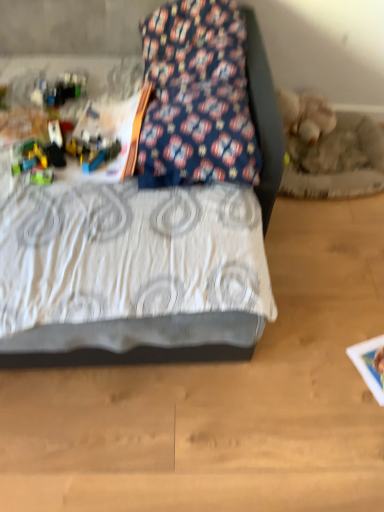
Question: Is floral fabric pillow at upper center smaller than translucent plastic blocks at left?

Choices:
 (A) yes
 (B) no

Answer: (B)

Question: Is floral fabric pillow at upper center to the right of translucent plastic blocks at left from the viewer's perspective?

Choices:
 (A) yes
 (B) no

Answer: (A)

Question: Considering the relative sizes of floral fabric pillow at upper center and translucent plastic blocks at left in the image provided, is floral fabric pillow at upper center taller than translucent plastic blocks at left?

Choices:
 (A) no
 (B) yes

Answer: (B)

Question: Could you tell me if floral fabric pillow at upper center is turned towards translucent plastic blocks at left?

Choices:
 (A) no
 (B) yes

Answer: (A)

Question: From a real-world perspective, is floral fabric pillow at upper center on top of translucent plastic blocks at left?

Choices:
 (A) yes
 (B) no

Answer: (A)

Question: Does point (244, 342) appear closer or farther from the camera than point (31, 153)?

Choices:
 (A) closer
 (B) farther

Answer: (A)

Question: Visually, is white textured bed at center positioned to the left or to the right of translucent plastic blocks at left?

Choices:
 (A) right
 (B) left

Answer: (A)

Question: Considering their positions, is white textured bed at center located in front of or behind translucent plastic blocks at left?

Choices:
 (A) front
 (B) behind

Answer: (A)

Question: Is white textured bed at center wider or thinner than translucent plastic blocks at left?

Choices:
 (A) wide
 (B) thin

Answer: (A)

Question: Is translucent plastic blocks at left bigger or smaller than floral fabric pillow at upper center?

Choices:
 (A) big
 (B) small

Answer: (B)

Question: Considering the positions of translucent plastic blocks at left and floral fabric pillow at upper center in the image, is translucent plastic blocks at left wider or thinner than floral fabric pillow at upper center?

Choices:
 (A) wide
 (B) thin

Answer: (B)

Question: Which is correct: translucent plastic blocks at left is inside floral fabric pillow at upper center, or outside of it?

Choices:
 (A) outside
 (B) inside

Answer: (A)

Question: In the image, is translucent plastic blocks at left positioned in front of or behind floral fabric pillow at upper center?

Choices:
 (A) front
 (B) behind

Answer: (B)

Question: Is white textured bed at center situated inside floral fabric pillow at upper center or outside?

Choices:
 (A) inside
 (B) outside

Answer: (B)

Question: In terms of size, does white textured bed at center appear bigger or smaller than floral fabric pillow at upper center?

Choices:
 (A) big
 (B) small

Answer: (A)